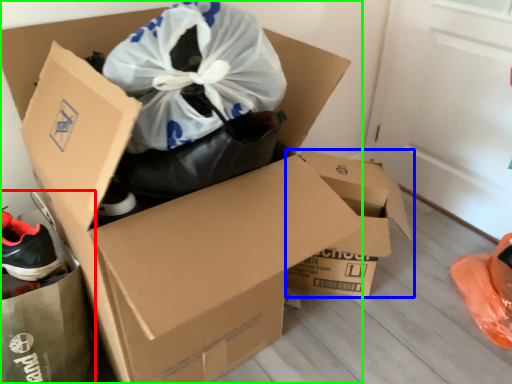
Question: Which object is positioned closest to garbage (highlighted by a red box)? Select from box (highlighted by a blue box) and box (highlighted by a green box).

Choices:
 (A) box
 (B) box

Answer: (B)